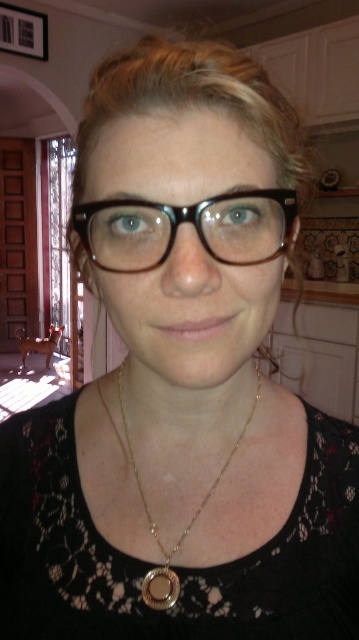
You are a photographer setting up a shoot in the room. You notice the black plastic glasses at center and the gold chain at center. Which object is closer to the camera lens based on their positions?

The black plastic glasses at center is in front of the gold chain at center, so it is closer to the camera lens.

You are arranging items on a shelf and need to place the black plastic glasses at center and the gold chain at center. According to the image, which item is positioned higher?

The black plastic glasses at center is located above the gold chain at center, so it is positioned higher.

You are arranging items on a shelf and need to place the black plastic glasses at center and the gold chain at center. According to the image, which item is located to the right of the other?

The black plastic glasses at center is positioned on the right side of gold chain at center, so the black plastic glasses at center is to the right of the gold chain at center.